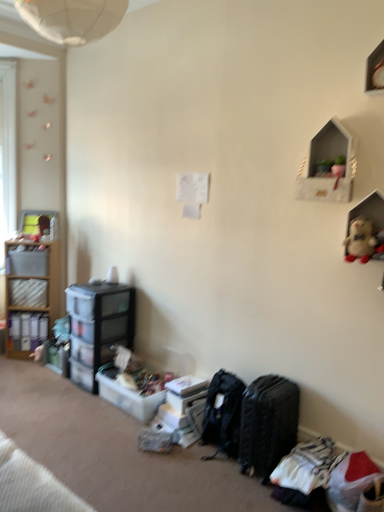
Question: Is matte plastic shelves at left, positioned as the first shelf in left-to-right order, not inside white matte shelf at upper right, acting as the 3th shelf starting from the left?

Choices:
 (A) yes
 (B) no

Answer: (A)

Question: Can you confirm if matte plastic shelves at left, which appears as the 1th shelf when viewed from the back, is positioned to the left of white matte shelf at upper right, the third shelf in the back-to-front sequence?

Choices:
 (A) yes
 (B) no

Answer: (A)

Question: Does matte plastic shelves at left, arranged as the 3th shelf when viewed from the front, have a lesser width compared to white matte shelf at upper right, the 1th shelf in the right-to-left sequence?

Choices:
 (A) no
 (B) yes

Answer: (A)

Question: Is matte plastic shelves at left, which appears as the 1th shelf when viewed from the back, far away from white matte shelf at upper right, the 1th shelf in the right-to-left sequence?

Choices:
 (A) no
 (B) yes

Answer: (B)

Question: Would you say matte plastic shelves at left, positioned as the first shelf in left-to-right order, contains white matte shelf at upper right, the 1th shelf in the right-to-left sequence?

Choices:
 (A) no
 (B) yes

Answer: (A)

Question: Is plastic storage box at lower center, the 2th storage box when ordered from bottom to top, inside the boundaries of translucent plastic storage box at lower center, which is the first storage box in bottom-to-top order, or outside?

Choices:
 (A) inside
 (B) outside

Answer: (B)

Question: Based on their sizes in the image, would you say plastic storage box at lower center, the 2th storage box when ordered from bottom to top, is bigger or smaller than translucent plastic storage box at lower center, which is the 3th storage box from left to right?

Choices:
 (A) small
 (B) big

Answer: (A)

Question: Is point (190, 401) closer or farther from the camera than point (145, 421)?

Choices:
 (A) closer
 (B) farther

Answer: (B)

Question: Considering the relative positions of plastic storage box at lower center, which is the fourth storage box in left-to-right order, and translucent plastic storage box at lower center, which is the 2th storage box in right-to-left order, in the image provided, is plastic storage box at lower center, which is the fourth storage box in left-to-right order, to the left or to the right of translucent plastic storage box at lower center, which is the 2th storage box in right-to-left order,?

Choices:
 (A) right
 (B) left

Answer: (A)

Question: Is matte black storage box at left, which is the second storage box from left to right, bigger or smaller than fluffy beige stuffed animal at upper right?

Choices:
 (A) small
 (B) big

Answer: (B)

Question: In terms of height, does matte black storage box at left, which is the second storage box from left to right, look taller or shorter compared to fluffy beige stuffed animal at upper right?

Choices:
 (A) short
 (B) tall

Answer: (A)

Question: From the image's perspective, is matte black storage box at left, marked as the fourth storage box in a bottom-to-top arrangement, located above or below fluffy beige stuffed animal at upper right?

Choices:
 (A) below
 (B) above

Answer: (A)

Question: Is matte black storage box at left, marked as the fourth storage box in a bottom-to-top arrangement, in front of or behind fluffy beige stuffed animal at upper right in the image?

Choices:
 (A) front
 (B) behind

Answer: (B)

Question: From the image's perspective, is black textured suitcase at lower right positioned above or below matte plastic shelves at left, which is counted as the 3th shelf, starting from the right?

Choices:
 (A) above
 (B) below

Answer: (B)

Question: Considering the positions of black textured suitcase at lower right and matte plastic shelves at left, which appears as the 1th shelf when viewed from the back, in the image, is black textured suitcase at lower right taller or shorter than matte plastic shelves at left, which appears as the 1th shelf when viewed from the back,?

Choices:
 (A) short
 (B) tall

Answer: (A)